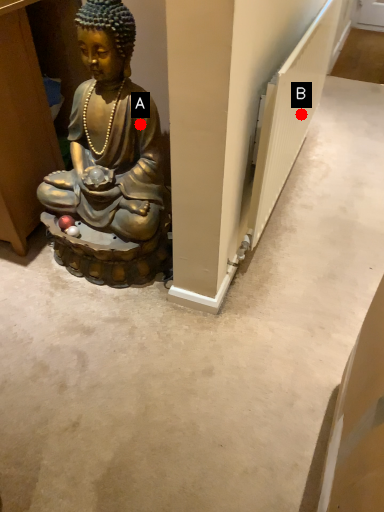
Question: Two points are circled on the image, labeled by A and B beside each circle. Which point is farther from the camera taking this photo?

Choices:
 (A) A is further
 (B) B is further

Answer: (B)